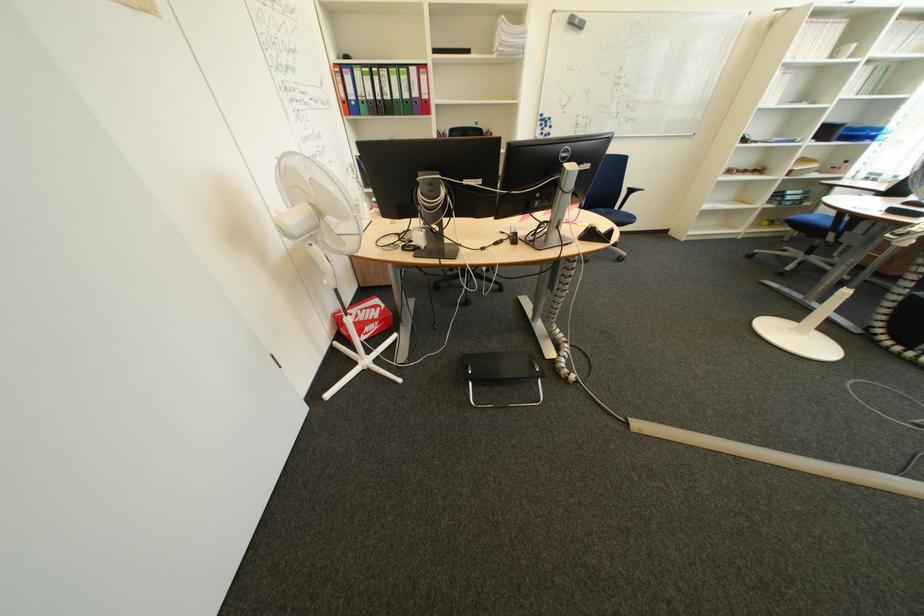
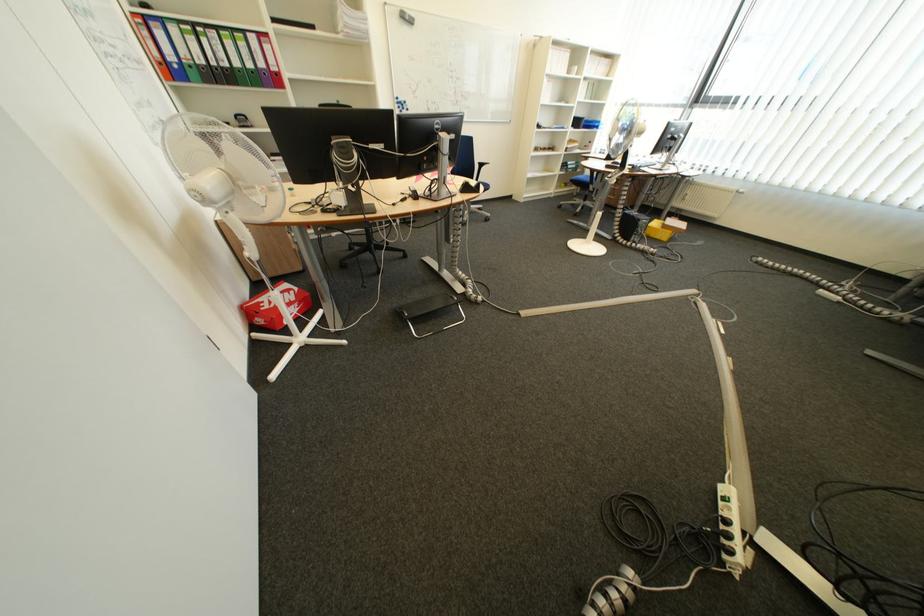
In the second image, find the point that corresponds to [483,373] in the first image.

(419, 315)